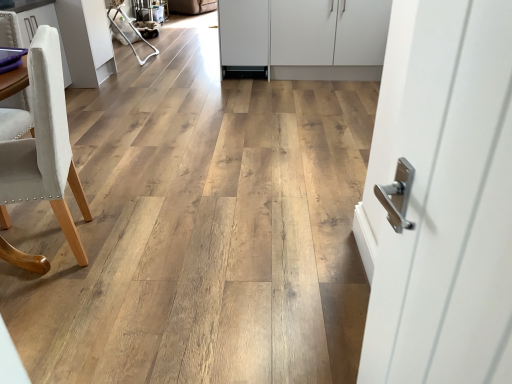
Find the location of a particular element. This screenshot has width=512, height=384. free space in front of light beige fabric chair at left is located at coordinates (53, 306).